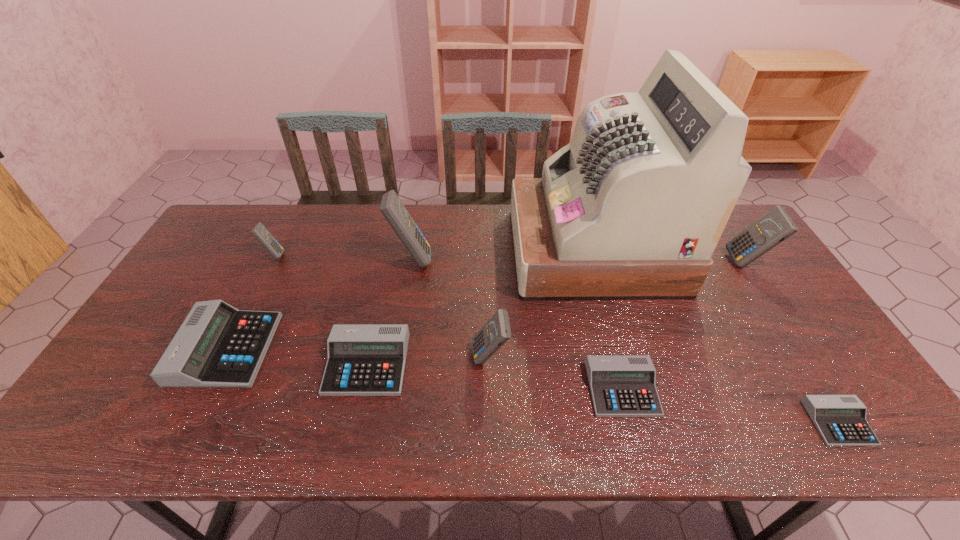
Point out which object is positioned as the fourth nearest to the third blue calculator from left to right. Please provide its 2D coordinates. Your answer should be formatted as a tuple, i.e. [(x, y)], where the tuple contains the x and y coordinates of a point satisfying the conditions above.

[(392, 208)]

Find the location of a particular element. calculator identified as the fifth closest to the fourth shortest calculator is located at coordinates (621, 385).

Image resolution: width=960 pixels, height=540 pixels. What are the coordinates of `calculator identified as the fourth closest to the nearest blue calculator` in the screenshot? It's located at (217, 346).

Locate which blue calculator ranks second in proximity to the rightmost blue calculator. Please provide its 2D coordinates. Your answer should be formatted as a tuple, i.e. [(x, y)], where the tuple contains the x and y coordinates of a point satisfying the conditions above.

[(392, 208)]

Locate which blue calculator ranks third in proximity to the second biggest blue calculator. Please provide its 2D coordinates. Your answer should be formatted as a tuple, i.e. [(x, y)], where the tuple contains the x and y coordinates of a point satisfying the conditions above.

[(259, 231)]

Locate an element on the screen. The width and height of the screenshot is (960, 540). gray calculator that stands as the fourth closest to the leftmost blue calculator is located at coordinates (840, 420).

Locate which gray calculator ranks in proximity to the fourth shortest object. Please provide its 2D coordinates. Your answer should be formatted as a tuple, i.e. [(x, y)], where the tuple contains the x and y coordinates of a point satisfying the conditions above.

[(363, 359)]

Image resolution: width=960 pixels, height=540 pixels. Find the location of `free space that satisfies the following two spatial constraints: 1. on the front side of the sixth tallest calculator; 2. on the right side of the rightmost gray calculator`. free space that satisfies the following two spatial constraints: 1. on the front side of the sixth tallest calculator; 2. on the right side of the rightmost gray calculator is located at coordinates (354, 423).

I want to click on vacant space that satisfies the following two spatial constraints: 1. on the front-facing side of the smallest gray calculator; 2. on the right side of the smallest blue calculator, so click(188, 423).

At what (x,y) coordinates should I click in order to perform the action: click on free space that satisfies the following two spatial constraints: 1. on the back side of the shortest calculator; 2. on the front-facing side of the leftmost blue calculator. Please return your answer as a coordinate pair (x, y). The image size is (960, 540). Looking at the image, I should click on (733, 255).